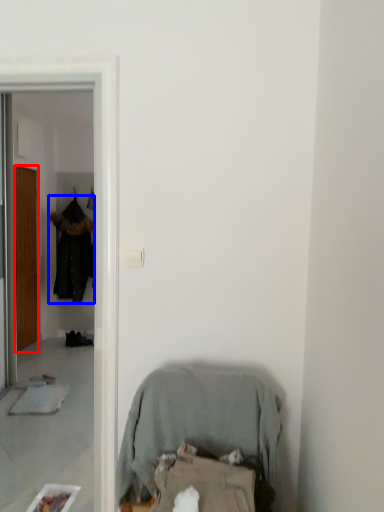
Question: Which point is further to the camera, door (highlighted by a red box) or clothing (highlighted by a blue box)?

Choices:
 (A) door
 (B) clothing

Answer: (B)